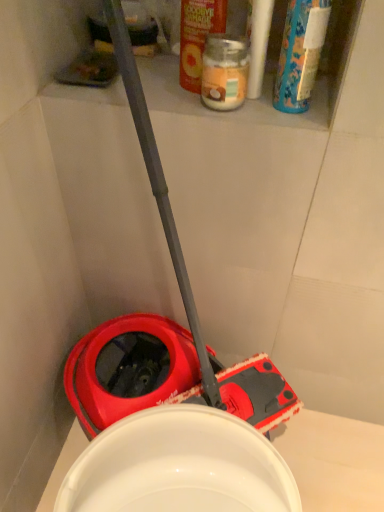
Where is `blue plastic bottle at upper right, which is counted as the 1th cleaning product, starting from the right`? Image resolution: width=384 pixels, height=512 pixels. blue plastic bottle at upper right, which is counted as the 1th cleaning product, starting from the right is located at coordinates (300, 54).

Measure the distance between point (204, 101) and camera.

They are 25.35 inches apart.

This screenshot has width=384, height=512. I want to click on blue plastic bottle at upper right, positioned as the second cleaning product in left-to-right order, so click(x=300, y=54).

Is blue plastic bottle at upper right, positioned as the second cleaning product in left-to-right order, positioned before orange matte jar at upper center, the 2th cleaning product viewed from the right?

Yes, blue plastic bottle at upper right, positioned as the second cleaning product in left-to-right order, is closer to the viewer.

Is orange matte jar at upper center, the 2th cleaning product viewed from the right, located within blue plastic bottle at upper right, positioned as the second cleaning product in left-to-right order?

That's incorrect, orange matte jar at upper center, the 2th cleaning product viewed from the right, is not inside blue plastic bottle at upper right, positioned as the second cleaning product in left-to-right order.

From a real-world perspective, does blue plastic bottle at upper right, positioned as the second cleaning product in left-to-right order, stand above orange matte jar at upper center, which is the 1th cleaning product from left to right?

Yes, from a real-world perspective, blue plastic bottle at upper right, positioned as the second cleaning product in left-to-right order, is over orange matte jar at upper center, which is the 1th cleaning product from left to right

Locate an element on the screen. cleaning product that appears on the right of orange matte jar at upper center, the 2th cleaning product viewed from the right is located at coordinates (300, 54).

Is there a large distance between orange matte jar at upper center, which is the 1th cleaning product from left to right, and blue plastic bottle at upper right, positioned as the second cleaning product in left-to-right order?

orange matte jar at upper center, which is the 1th cleaning product from left to right, is actually quite close to blue plastic bottle at upper right, positioned as the second cleaning product in left-to-right order.

Which object is further away from the camera taking this photo, orange matte jar at upper center, which is the 1th cleaning product from left to right, or blue plastic bottle at upper right, positioned as the second cleaning product in left-to-right order?

orange matte jar at upper center, which is the 1th cleaning product from left to right, is further from the camera.

Based on the photo, considering the sizes of orange matte jar at upper center, the 2th cleaning product viewed from the right, and blue plastic bottle at upper right, positioned as the second cleaning product in left-to-right order, in the image, is orange matte jar at upper center, the 2th cleaning product viewed from the right, wider or thinner than blue plastic bottle at upper right, positioned as the second cleaning product in left-to-right order,?

In the image, orange matte jar at upper center, the 2th cleaning product viewed from the right, appears to be more narrow than blue plastic bottle at upper right, positioned as the second cleaning product in left-to-right order.

Is blue plastic bottle at upper right, positioned as the second cleaning product in left-to-right order, inside the boundaries of translucent glass jar at upper center, or outside?

blue plastic bottle at upper right, positioned as the second cleaning product in left-to-right order, is outside translucent glass jar at upper center.

Considering the relative positions of blue plastic bottle at upper right, positioned as the second cleaning product in left-to-right order, and translucent glass jar at upper center in the image provided, is blue plastic bottle at upper right, positioned as the second cleaning product in left-to-right order, to the right of translucent glass jar at upper center from the viewer's perspective?

Yes, blue plastic bottle at upper right, positioned as the second cleaning product in left-to-right order, is to the right of translucent glass jar at upper center.

Looking at this image, from a real-world perspective, is blue plastic bottle at upper right, which is counted as the 1th cleaning product, starting from the right, above or below translucent glass jar at upper center?

blue plastic bottle at upper right, which is counted as the 1th cleaning product, starting from the right, is above translucent glass jar at upper center.

From their relative heights in the image, would you say blue plastic bottle at upper right, which is counted as the 1th cleaning product, starting from the right, is taller or shorter than translucent glass jar at upper center?

Considering their sizes, blue plastic bottle at upper right, which is counted as the 1th cleaning product, starting from the right, has more height than translucent glass jar at upper center.

In the image, is orange matte jar at upper center, which is the 1th cleaning product from left to right, positioned in front of or behind translucent glass jar at upper center?

Clearly, orange matte jar at upper center, which is the 1th cleaning product from left to right, is in front of translucent glass jar at upper center.

Which is more to the right, orange matte jar at upper center, the 2th cleaning product viewed from the right, or translucent glass jar at upper center?

translucent glass jar at upper center is more to the right.

Based on the photo, from the image's perspective, is orange matte jar at upper center, which is the 1th cleaning product from left to right, below translucent glass jar at upper center?

No, from the image's perspective, orange matte jar at upper center, which is the 1th cleaning product from left to right, is not beneath translucent glass jar at upper center.

Would you say translucent glass jar at upper center is a long distance from orange matte jar at upper center, the 2th cleaning product viewed from the right?

No, translucent glass jar at upper center is not far from orange matte jar at upper center, the 2th cleaning product viewed from the right.

Can you tell me how much translucent glass jar at upper center and orange matte jar at upper center, which is the 1th cleaning product from left to right, differ in facing direction?

The angular difference between translucent glass jar at upper center and orange matte jar at upper center, which is the 1th cleaning product from left to right, is 11.4 degrees.

Does translucent glass jar at upper center have a greater height compared to orange matte jar at upper center, the 2th cleaning product viewed from the right?

No.

Between translucent glass jar at upper center and orange matte jar at upper center, which is the 1th cleaning product from left to right, which one has larger size?

Bigger between the two is orange matte jar at upper center, which is the 1th cleaning product from left to right.

Is translucent glass jar at upper center oriented away from blue plastic bottle at upper right, positioned as the second cleaning product in left-to-right order?

No, blue plastic bottle at upper right, positioned as the second cleaning product in left-to-right order, is not at the back of translucent glass jar at upper center.

Is translucent glass jar at upper center not close to blue plastic bottle at upper right, which is counted as the 1th cleaning product, starting from the right?

No, translucent glass jar at upper center is in close proximity to blue plastic bottle at upper right, which is counted as the 1th cleaning product, starting from the right.

Which of these two, translucent glass jar at upper center or blue plastic bottle at upper right, positioned as the second cleaning product in left-to-right order, is thinner?

Thinner between the two is blue plastic bottle at upper right, positioned as the second cleaning product in left-to-right order.

From a real-world perspective, between translucent glass jar at upper center and blue plastic bottle at upper right, which is counted as the 1th cleaning product, starting from the right, who is vertically lower?

translucent glass jar at upper center, from a real-world perspective.

Identify the location of cleaning product that appears on the right of orange matte jar at upper center, which is the 1th cleaning product from left to right. The image size is (384, 512). (300, 54).

Image resolution: width=384 pixels, height=512 pixels. In order to click on cleaning product that appears behind the blue plastic bottle at upper right, positioned as the second cleaning product in left-to-right order in this screenshot , I will do `click(198, 37)`.

When comparing their distances from translucent glass jar at upper center, does blue plastic bottle at upper right, positioned as the second cleaning product in left-to-right order, or orange matte jar at upper center, the 2th cleaning product viewed from the right, seem closer?

orange matte jar at upper center, the 2th cleaning product viewed from the right.

Which object lies further to the anchor point blue plastic bottle at upper right, which is counted as the 1th cleaning product, starting from the right, translucent glass jar at upper center or orange matte jar at upper center, the 2th cleaning product viewed from the right?

Based on the image, orange matte jar at upper center, the 2th cleaning product viewed from the right, appears to be further to blue plastic bottle at upper right, which is counted as the 1th cleaning product, starting from the right.

When comparing their distances from translucent glass jar at upper center, does orange matte jar at upper center, which is the 1th cleaning product from left to right, or blue plastic bottle at upper right, positioned as the second cleaning product in left-to-right order, seem closer?

orange matte jar at upper center, which is the 1th cleaning product from left to right, lies closer to translucent glass jar at upper center than the other object.

Which object lies nearer to the anchor point orange matte jar at upper center, which is the 1th cleaning product from left to right, blue plastic bottle at upper right, which is counted as the 1th cleaning product, starting from the right, or translucent glass jar at upper center?

translucent glass jar at upper center is closer to orange matte jar at upper center, which is the 1th cleaning product from left to right.

Which object lies further to the anchor point blue plastic bottle at upper right, which is counted as the 1th cleaning product, starting from the right, orange matte jar at upper center, which is the 1th cleaning product from left to right, or translucent glass jar at upper center?

orange matte jar at upper center, which is the 1th cleaning product from left to right.

Based on their spatial positions, is translucent glass jar at upper center or blue plastic bottle at upper right, positioned as the second cleaning product in left-to-right order, closer to orange matte jar at upper center, the 2th cleaning product viewed from the right?

translucent glass jar at upper center.

This screenshot has height=512, width=384. Find the location of `bottle located between orange matte jar at upper center, the 2th cleaning product viewed from the right, and blue plastic bottle at upper right, positioned as the second cleaning product in left-to-right order, in the left-right direction`. bottle located between orange matte jar at upper center, the 2th cleaning product viewed from the right, and blue plastic bottle at upper right, positioned as the second cleaning product in left-to-right order, in the left-right direction is located at coordinates (224, 72).